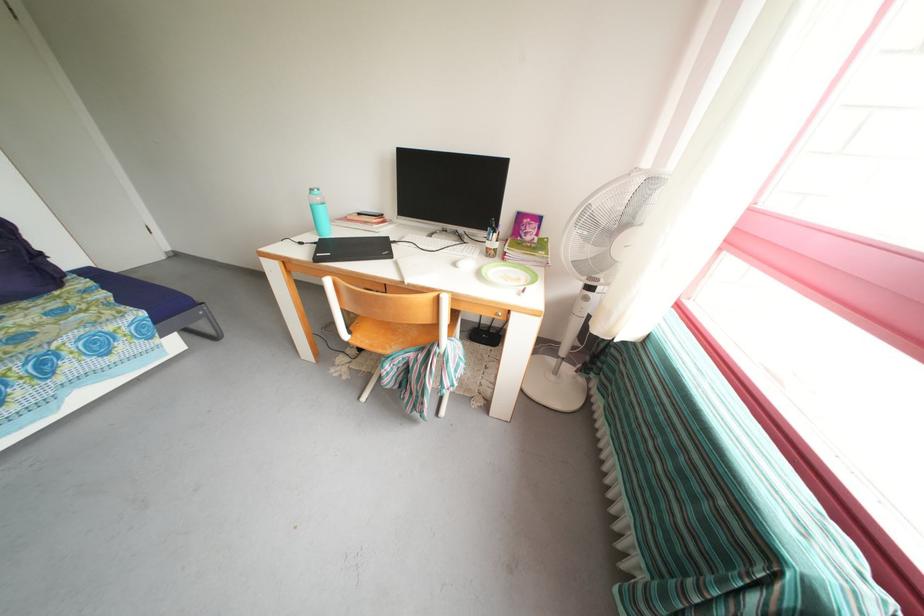
What are the coordinates of `chair sitting surface` in the screenshot? It's located at (390, 334).